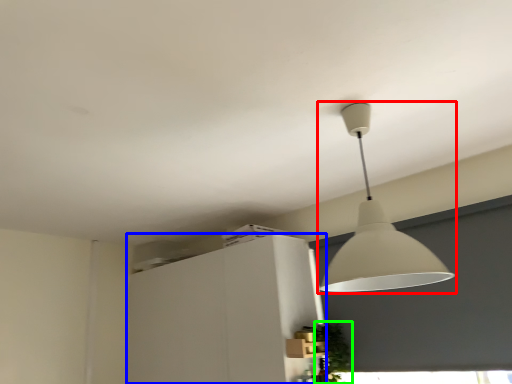
Question: Which object is the closest to the lamp (highlighted by a red box)? Choose among these: cabinetry (highlighted by a blue box) or plant (highlighted by a green box).

Choices:
 (A) cabinetry
 (B) plant

Answer: (B)